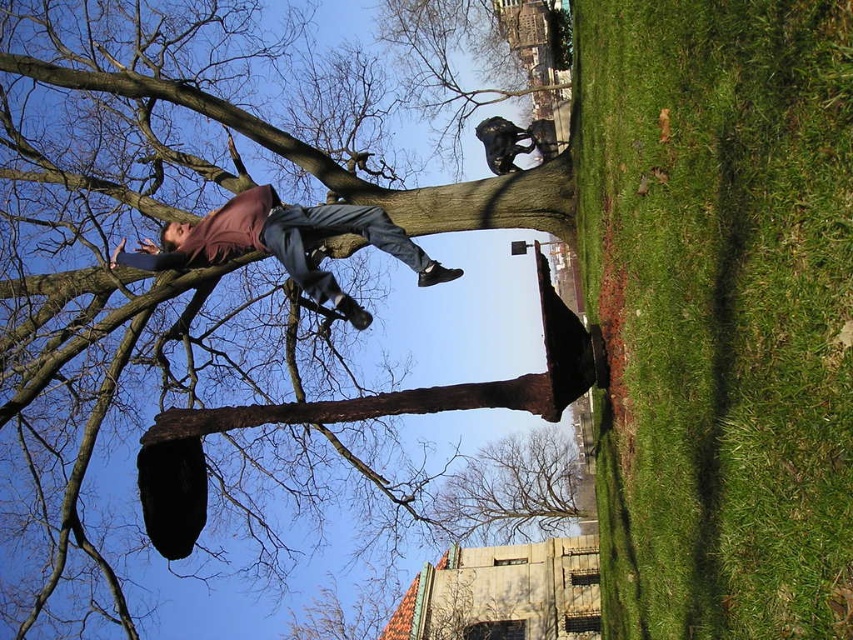
Question: Is brown rough tree trunk at upper center above matte brown pants at upper center?

Choices:
 (A) no
 (B) yes

Answer: (A)

Question: Among these points, which one is farthest from the camera?

Choices:
 (A) (70, 45)
 (B) (425, 276)

Answer: (A)

Question: Can you confirm if brown rough tree trunk at upper center is positioned to the right of matte brown pants at upper center?

Choices:
 (A) no
 (B) yes

Answer: (B)

Question: Can you confirm if brown rough tree trunk at upper center is positioned to the right of matte brown pants at upper center?

Choices:
 (A) yes
 (B) no

Answer: (A)